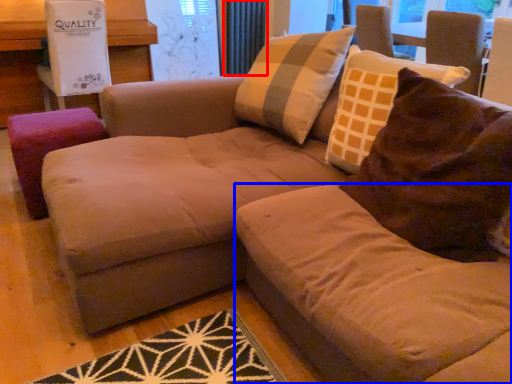
Question: Which object is further to the camera taking this photo, radiator (highlighted by a red box) or beige (highlighted by a blue box)?

Choices:
 (A) radiator
 (B) beige

Answer: (A)